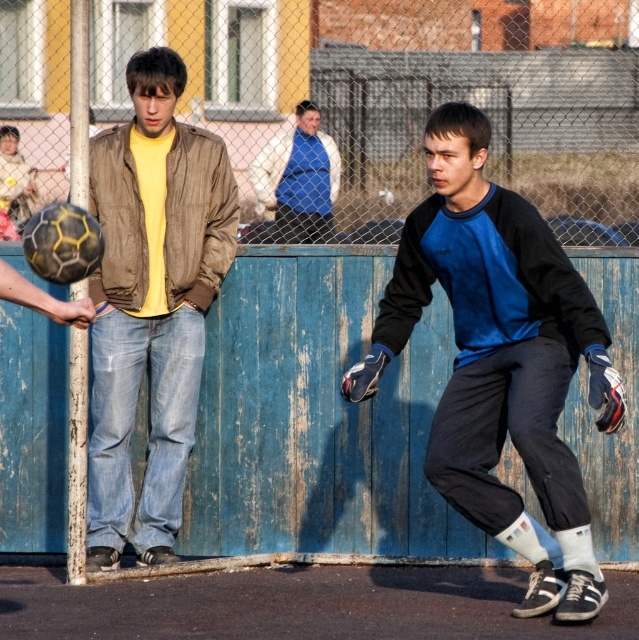
Who is more forward, [413,20] or [320,218]?

Point [413,20]

Is point (332, 214) positioned before point (261, 188)?

No, (332, 214) is behind (261, 188).

What do you see at coordinates (401, 97) in the screenshot?
I see `blue wooden fence at center` at bounding box center [401, 97].

Identify the location of blue wooden fence at center. This screenshot has height=640, width=639. (401, 97).

Between blue velour jacket at center and matte brown jacket at center, which one appears on the left side from the viewer's perspective?

matte brown jacket at center

I want to click on blue velour jacket at center, so click(x=500, y=360).

The width and height of the screenshot is (639, 640). What are the coordinates of `blue velour jacket at center` in the screenshot? It's located at (500, 360).

Who is lower down, blue wooden fence at center or blue velour jacket at center?

blue velour jacket at center is lower down.

Can you confirm if blue wooden fence at center is taller than blue velour jacket at center?

Incorrect, blue wooden fence at center's height is not larger of blue velour jacket at center's.

Who is more forward, (328, 224) or (546, 556)?

Point (546, 556)

Where is `blue wooden fence at center`? Image resolution: width=639 pixels, height=640 pixels. blue wooden fence at center is located at coordinates (x=401, y=97).